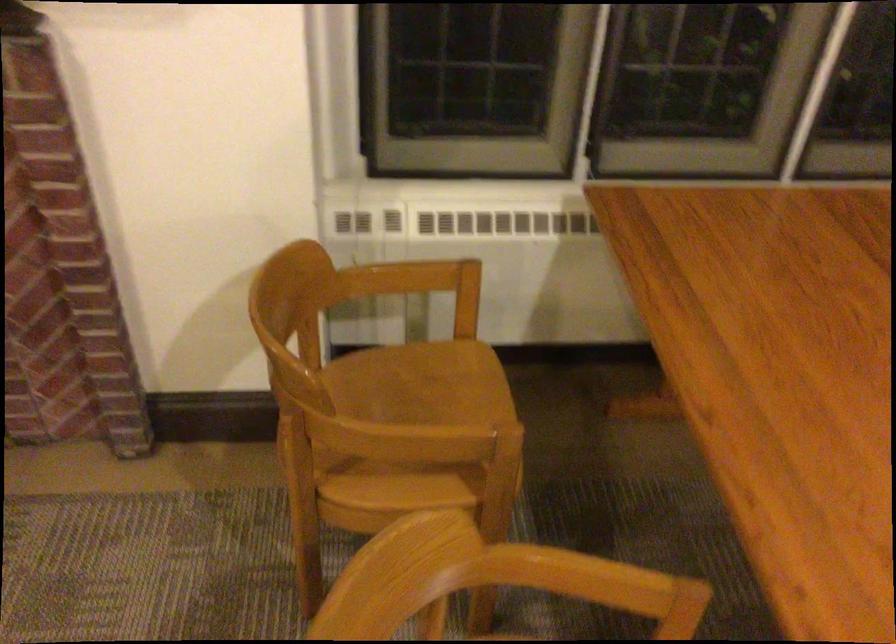
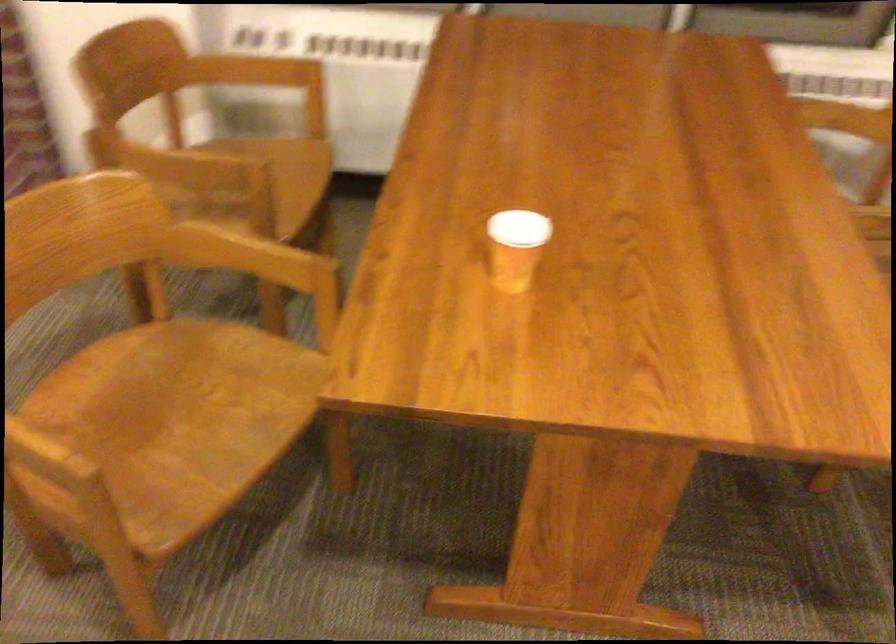
Question: The camera is either moving clockwise (left) or counter-clockwise (right) around the object. The first image is from the beginning of the video and the second image is from the end. Is the camera moving left or right when shooting the video?

Choices:
 (A) Left
 (B) Right

Answer: (B)